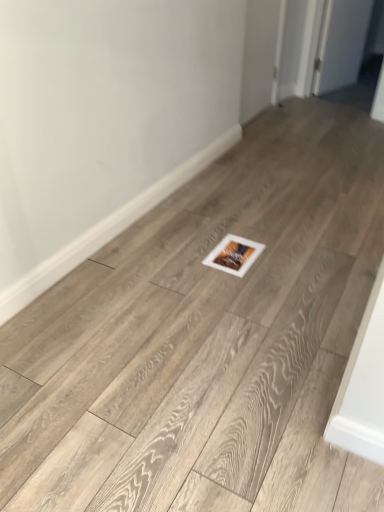
Image resolution: width=384 pixels, height=512 pixels. In order to click on vacant space that is to the left of white matte picture frame at center in this screenshot , I will do `click(186, 250)`.